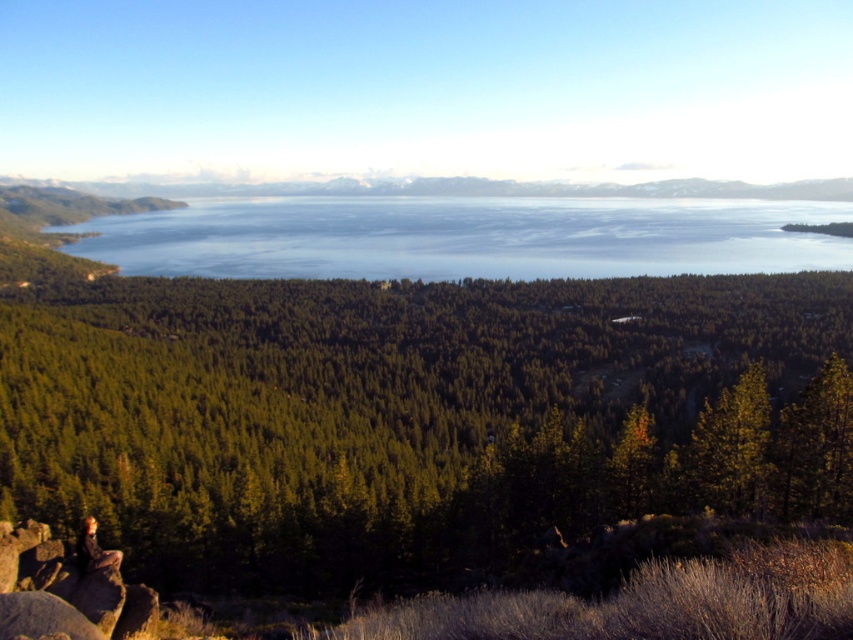
You are a hiker standing at the edge of the forest and looking out at the scene. You notice the green matte tree at center and the blue water at center. Which object is shorter in height?

The green matte tree at center is shorter in height compared to the blue water at center.

You are a landscape photographer planning to capture the entire scene in one shot. Given that the green matte tree at center and the blue water at center are both in the frame, which object will appear smaller in the photograph?

The green matte tree at center will appear smaller in the photograph because it occupies less space than the blue water at center according to the description.